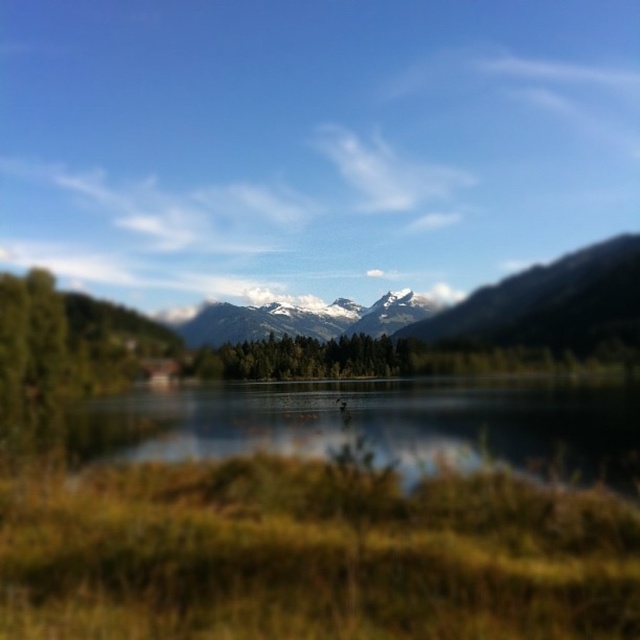
Question: Which point is closer to the camera?

Choices:
 (A) clear water at center
 (B) snowy granite mountains at center

Answer: (A)

Question: Is snowy granite mountains at center below green matte trees at center?

Choices:
 (A) yes
 (B) no

Answer: (B)

Question: Is snowy granite mountains at center positioned behind green matte trees at center?

Choices:
 (A) no
 (B) yes

Answer: (B)

Question: Which of the following is the farthest from the observer?

Choices:
 (A) clear water at center
 (B) snowy granite mountains at center
 (C) green matte trees at center

Answer: (B)

Question: From the image, what is the correct spatial relationship of clear water at center in relation to green matte trees at center?

Choices:
 (A) right
 (B) left

Answer: (A)

Question: Among these objects, which one is farthest from the camera?

Choices:
 (A) green matte trees at center
 (B) clear water at center
 (C) snowy granite mountains at center

Answer: (C)